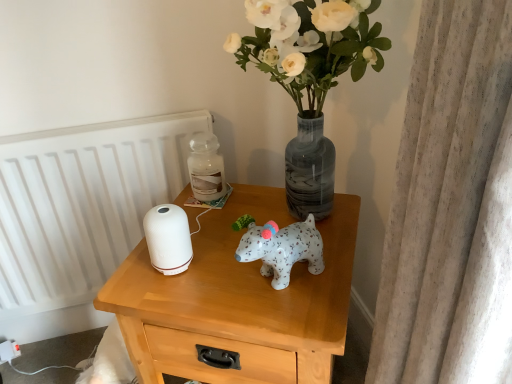
Question: From a real-world perspective, is white matte nightstand at center physically below white glossy radiator at left?

Choices:
 (A) yes
 (B) no

Answer: (A)

Question: Does white matte nightstand at center have a larger size compared to white glossy radiator at left?

Choices:
 (A) no
 (B) yes

Answer: (B)

Question: Considering the relative sizes of white matte nightstand at center and white glossy radiator at left in the image provided, is white matte nightstand at center thinner than white glossy radiator at left?

Choices:
 (A) no
 (B) yes

Answer: (A)

Question: Is white matte nightstand at center further to camera compared to white glossy radiator at left?

Choices:
 (A) yes
 (B) no

Answer: (B)

Question: From the image's perspective, is white matte nightstand at center beneath white glossy radiator at left?

Choices:
 (A) yes
 (B) no

Answer: (A)

Question: Is white matte nightstand at center situated inside white glossy radiator at left or outside?

Choices:
 (A) inside
 (B) outside

Answer: (B)

Question: Is white matte nightstand at center bigger or smaller than white glossy radiator at left?

Choices:
 (A) big
 (B) small

Answer: (A)

Question: From a real-world perspective, is white matte nightstand at center above or below white glossy radiator at left?

Choices:
 (A) above
 (B) below

Answer: (B)

Question: Based on their positions, is white matte nightstand at center located to the left or right of white glossy radiator at left?

Choices:
 (A) left
 (B) right

Answer: (B)

Question: Considering their positions, is white glossy radiator at left located in front of or behind white matte vase at upper center?

Choices:
 (A) front
 (B) behind

Answer: (B)

Question: Is white glossy radiator at left bigger or smaller than white matte vase at upper center?

Choices:
 (A) big
 (B) small

Answer: (B)

Question: Is white glossy radiator at left inside or outside of white matte vase at upper center?

Choices:
 (A) outside
 (B) inside

Answer: (A)

Question: From a real-world perspective, relative to white matte vase at upper center, is white glossy radiator at left vertically above or below?

Choices:
 (A) above
 (B) below

Answer: (B)

Question: Is translucent glass jar at upper center bigger or smaller than white glossy radiator at left?

Choices:
 (A) small
 (B) big

Answer: (A)

Question: From a real-world perspective, is translucent glass jar at upper center above or below white glossy radiator at left?

Choices:
 (A) above
 (B) below

Answer: (A)